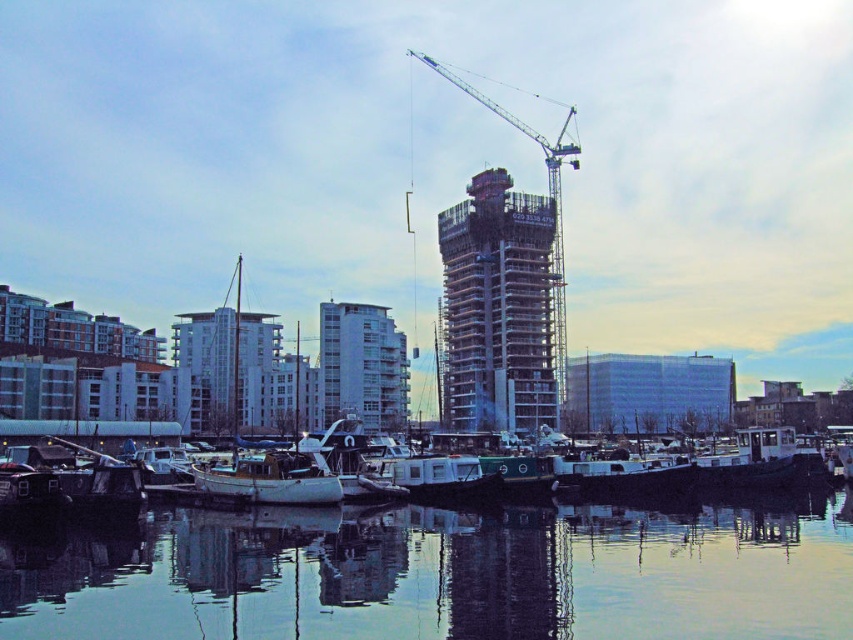
Question: Is reflective glass water at center wider than white concrete building at center?

Choices:
 (A) no
 (B) yes

Answer: (B)

Question: Can you confirm if reflective glass water at center is bigger than concrete scaffolding at center?

Choices:
 (A) yes
 (B) no

Answer: (B)

Question: Can you confirm if white concrete building at center is smaller than white matte boat at center?

Choices:
 (A) yes
 (B) no

Answer: (B)

Question: Estimate the real-world distances between objects in this image. Which object is closer to the reflective glass water at center?

Choices:
 (A) white concrete building at center
 (B) white matte boat at center
 (C) white matte boat at lower center
 (D) concrete scaffolding at center

Answer: (C)

Question: Which is nearer to the white concrete building at center?

Choices:
 (A) white matte boat at center
 (B) white matte boat at lower center

Answer: (A)

Question: Which object is closer to the camera taking this photo?

Choices:
 (A) concrete scaffolding at center
 (B) white matte boat at center
 (C) white matte boat at lower center

Answer: (C)